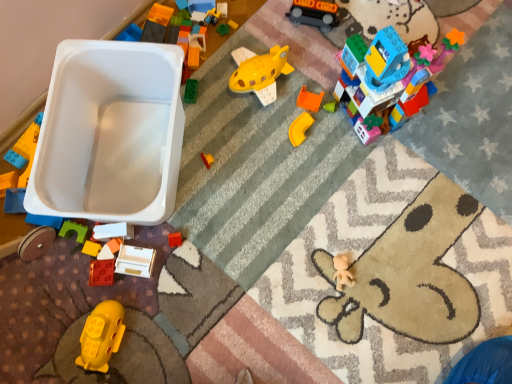
Where is `free area in between matte white drawer at lower center, positioned as the 4th toy in right-to-left order, and multicolored plastic building block at upper right, which appears as the seventh toy when ordered from the bottom`? The width and height of the screenshot is (512, 384). free area in between matte white drawer at lower center, positioned as the 4th toy in right-to-left order, and multicolored plastic building block at upper right, which appears as the seventh toy when ordered from the bottom is located at coordinates coord(267,177).